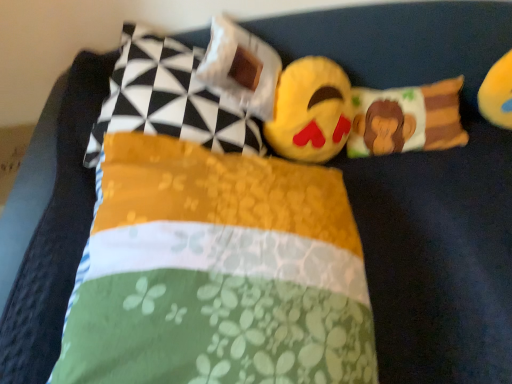
Question: Does yellow plush toy at upper right, which appears as the 1th toy when viewed from the right, come in front of white fabric pillow at upper center, the second pillow positioned from the left?

Choices:
 (A) no
 (B) yes

Answer: (A)

Question: Considering the relative sizes of yellow plush toy at upper right, acting as the 2th toy starting from the left, and white fabric pillow at upper center, positioned as the third pillow in right-to-left order, in the image provided, is yellow plush toy at upper right, acting as the 2th toy starting from the left, smaller than white fabric pillow at upper center, positioned as the third pillow in right-to-left order,?

Choices:
 (A) no
 (B) yes

Answer: (B)

Question: Is yellow plush toy at upper right, which appears as the 1th toy when viewed from the right, positioned with its back to white fabric pillow at upper center, positioned as the third pillow in right-to-left order?

Choices:
 (A) no
 (B) yes

Answer: (A)

Question: Can you confirm if yellow plush toy at upper right, acting as the 2th toy starting from the left, is positioned to the right of white fabric pillow at upper center, the second pillow positioned from the left?

Choices:
 (A) no
 (B) yes

Answer: (B)

Question: Is yellow plush toy at upper right, which appears as the 1th toy when viewed from the right, far away from white fabric pillow at upper center, positioned as the third pillow in right-to-left order?

Choices:
 (A) yes
 (B) no

Answer: (B)

Question: Considering the relative sizes of yellow plush toy at upper right, which appears as the 1th toy when viewed from the right, and white fabric pillow at upper center, positioned as the third pillow in right-to-left order, in the image provided, is yellow plush toy at upper right, which appears as the 1th toy when viewed from the right, shorter than white fabric pillow at upper center, positioned as the third pillow in right-to-left order,?

Choices:
 (A) no
 (B) yes

Answer: (A)

Question: From the image's perspective, is white fabric pillow at upper center, positioned as the third pillow in right-to-left order, on top of yellow plush toy at upper right, which appears as the 1th toy when viewed from the right?

Choices:
 (A) yes
 (B) no

Answer: (B)

Question: Is white fabric pillow at upper center, the second pillow positioned from the left, positioned far away from yellow plush toy at upper right, acting as the 2th toy starting from the left?

Choices:
 (A) no
 (B) yes

Answer: (A)

Question: Does white fabric pillow at upper center, positioned as the third pillow in right-to-left order, come behind yellow plush toy at upper right, which appears as the 1th toy when viewed from the right?

Choices:
 (A) no
 (B) yes

Answer: (A)

Question: Considering the relative sizes of white fabric pillow at upper center, the second pillow positioned from the left, and yellow plush toy at upper right, acting as the 2th toy starting from the left, in the image provided, is white fabric pillow at upper center, the second pillow positioned from the left, wider than yellow plush toy at upper right, acting as the 2th toy starting from the left,?

Choices:
 (A) no
 (B) yes

Answer: (B)

Question: Is white fabric pillow at upper center, the second pillow positioned from the left, closer to camera compared to yellow plush toy at upper right, acting as the 2th toy starting from the left?

Choices:
 (A) no
 (B) yes

Answer: (B)

Question: Does white fabric pillow at upper center, the second pillow positioned from the left, touch yellow plush toy at upper right, acting as the 2th toy starting from the left?

Choices:
 (A) yes
 (B) no

Answer: (B)

Question: Considering the relative sizes of yellow plush toy at upper right, acting as the 2th toy starting from the left, and fluffy fabric monkey pillow at center, which ranks as the 1th pillow in right-to-left order, in the image provided, is yellow plush toy at upper right, acting as the 2th toy starting from the left, bigger than fluffy fabric monkey pillow at center, which ranks as the 1th pillow in right-to-left order,?

Choices:
 (A) no
 (B) yes

Answer: (A)